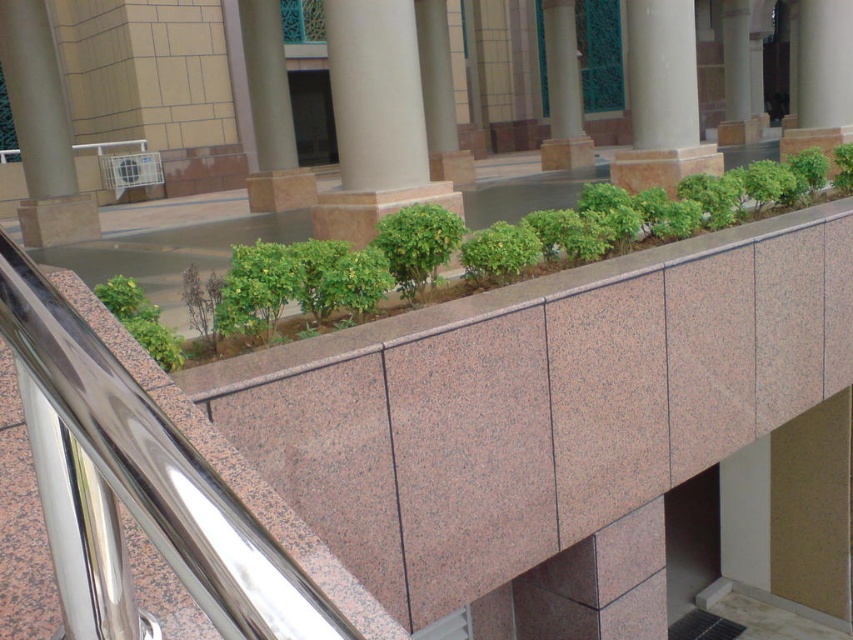
Question: Which point appears farthest from the camera in this image?

Choices:
 (A) (158, 307)
 (B) (445, 70)
 (C) (260, 150)

Answer: (B)

Question: Considering the real-world distances, which object is farthest from the green leafy shrub at upper left?

Choices:
 (A) beige polished stone pillar at center
 (B) brown polished stone pillar at center

Answer: (A)

Question: Where is brown polished stone pillar at center located in relation to green leafy shrub at upper left in the image?

Choices:
 (A) left
 (B) right

Answer: (A)

Question: Which object is positioned closest to the green leafy shrub at upper left?

Choices:
 (A) smooth beige column at center
 (B) beige polished stone pillar at center
 (C) beige polished stone pillar at upper left
 (D) pink granite pillar at center

Answer: (A)

Question: Can you confirm if smooth beige column at center is positioned above beige polished stone pillar at upper left?

Choices:
 (A) no
 (B) yes

Answer: (B)

Question: From the image, what is the correct spatial relationship of smooth beige column at center in relation to pink granite pillar at center?

Choices:
 (A) right
 (B) left

Answer: (A)